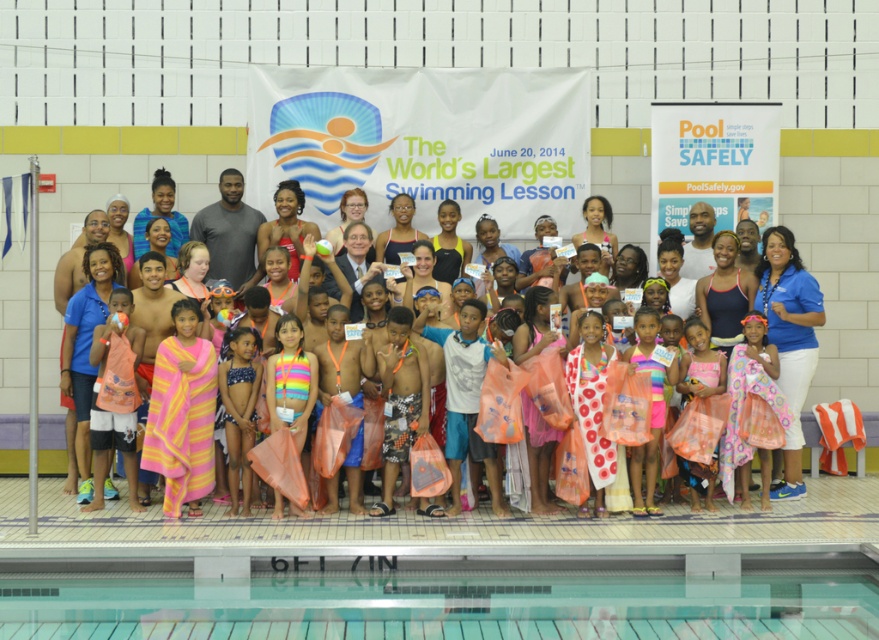
Is clear glass water at lower center closer to the viewer compared to multicolored towel at center?

Yes, clear glass water at lower center is closer to the viewer.

This screenshot has height=640, width=879. I want to click on clear glass water at lower center, so click(x=440, y=600).

This screenshot has height=640, width=879. Identify the location of clear glass water at lower center. (440, 600).

Can you confirm if multicolored towel at center is thinner than multicolored fabric bikini at center?

No.

Is multicolored towel at center positioned in front of multicolored fabric bikini at center?

No, multicolored towel at center is behind multicolored fabric bikini at center.

This screenshot has height=640, width=879. I want to click on multicolored towel at center, so [814, 244].

Does clear glass water at lower center come behind multicolored fabric bikini at center?

No, clear glass water at lower center is in front of multicolored fabric bikini at center.

You are a GUI agent. You are given a task and a screenshot of the screen. Output one action in this format:
    pyautogui.click(x=<x>, y=<y>)
    Task: Click on the clear glass water at lower center
    The height and width of the screenshot is (640, 879).
    Given the screenshot: What is the action you would take?
    pyautogui.click(x=440, y=600)

In order to click on clear glass water at lower center in this screenshot , I will do point(440,600).